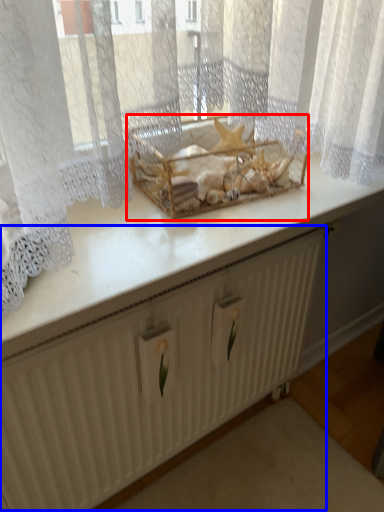
Question: Which object appears farthest to the camera in this image, crate (highlighted by a red box) or radiator (highlighted by a blue box)?

Choices:
 (A) crate
 (B) radiator

Answer: (A)